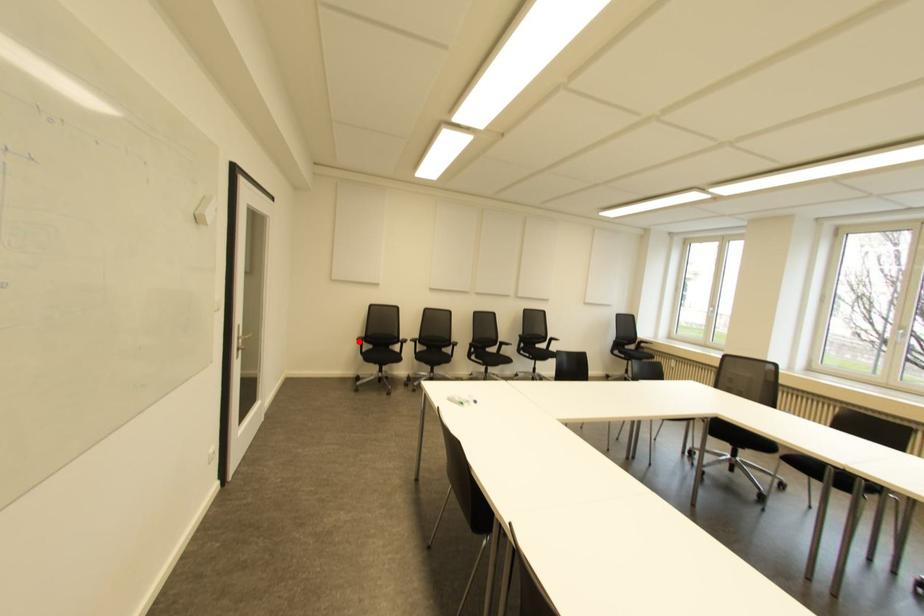
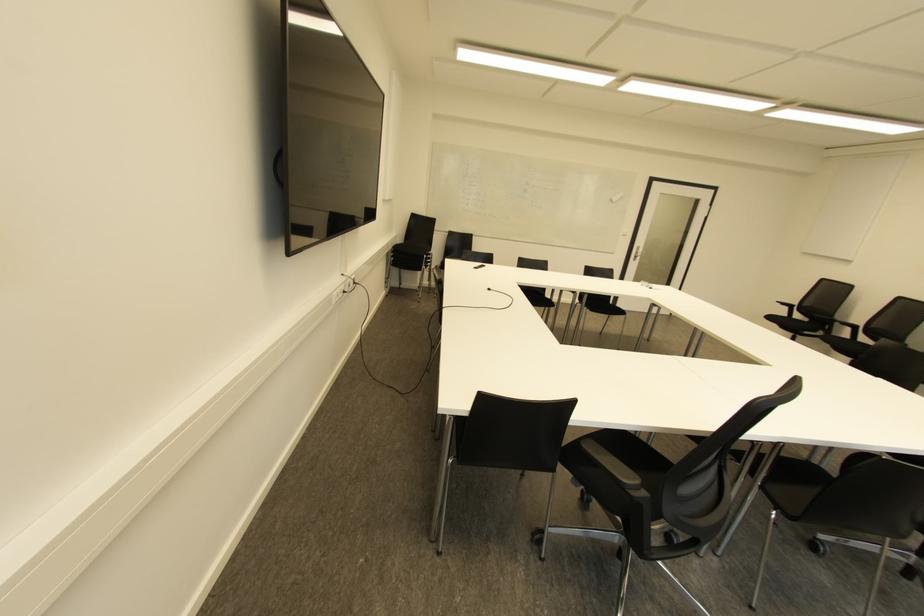
The point at the highlighted location is marked in the first image. Where is the corresponding point in the second image?

(785, 307)